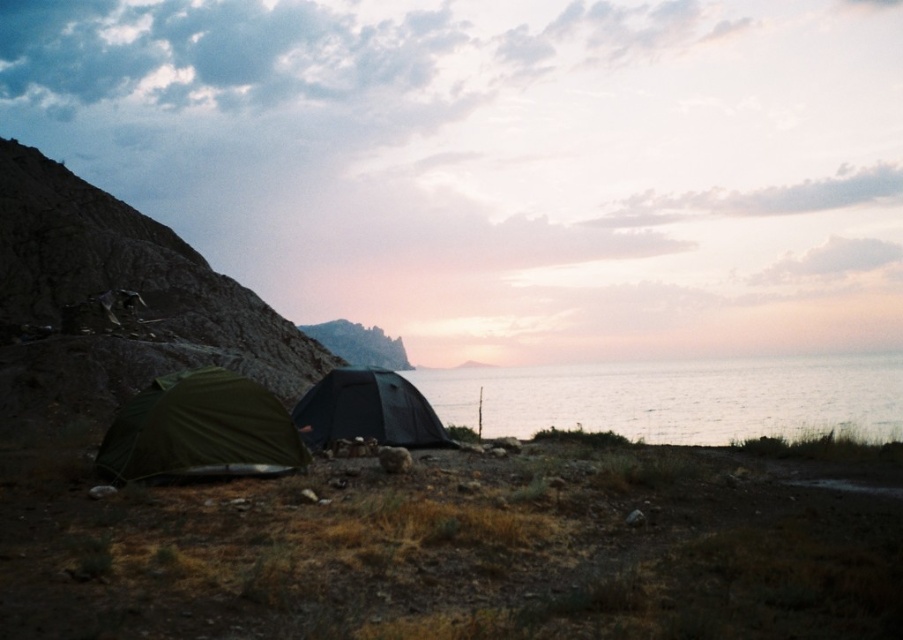
Is green fabric tent at lower left shorter than black matte tent at lower left?

Yes.

At what (x,y) coordinates should I click in order to perform the action: click on green fabric tent at lower left. Please return your answer as a coordinate pair (x, y). This screenshot has width=903, height=640. Looking at the image, I should click on (201, 429).

Is silvery water at center to the right of green fabric tent at lower left from the viewer's perspective?

Correct, you'll find silvery water at center to the right of green fabric tent at lower left.

Locate an element on the screen. This screenshot has width=903, height=640. silvery water at center is located at coordinates pyautogui.click(x=677, y=397).

What do you see at coordinates (677, 397) in the screenshot? Image resolution: width=903 pixels, height=640 pixels. I see `silvery water at center` at bounding box center [677, 397].

Does silvery water at center have a smaller size compared to black matte tent at lower left?

No.

In order to click on silvery water at center in this screenshot , I will do `click(677, 397)`.